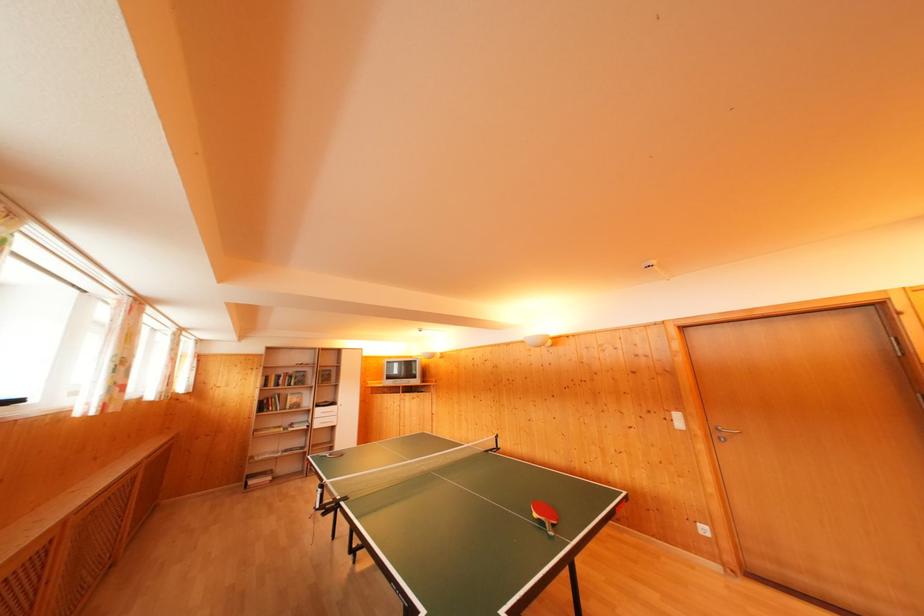
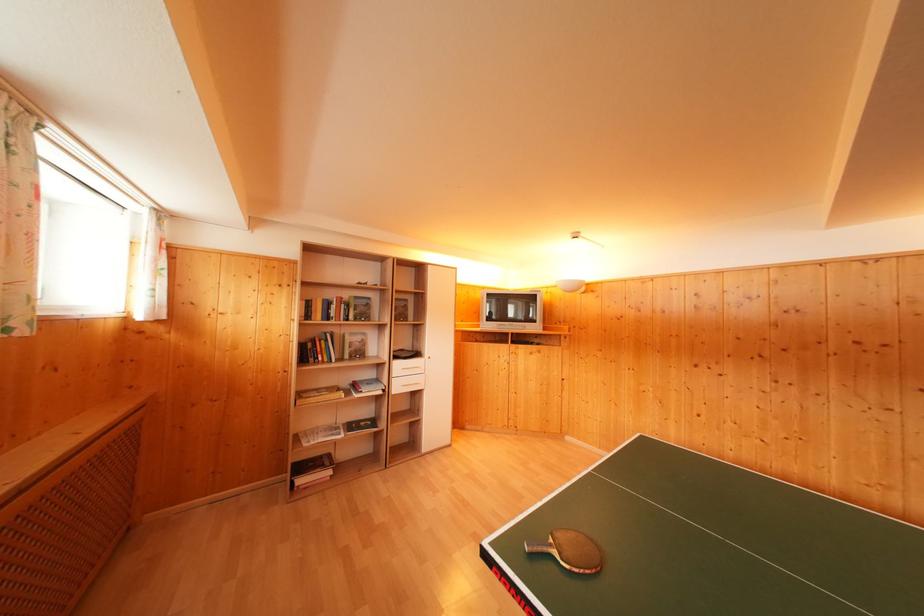
In the second image, find the point that corresponds to point 294,397 in the first image.

(350, 336)